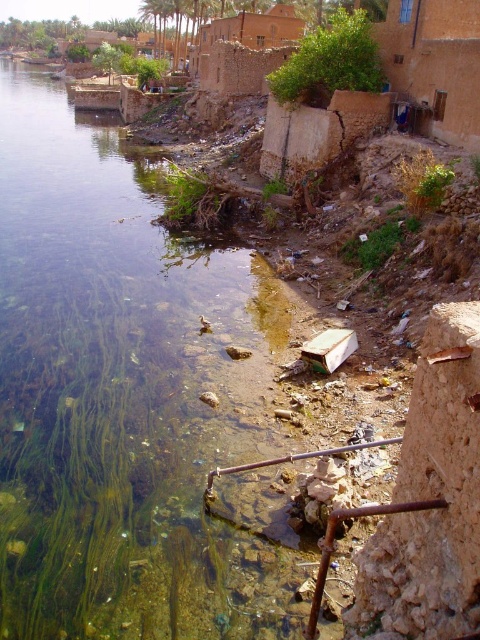
Question: In this image, where is clear water at river left located relative to green leafy bush at upper center?

Choices:
 (A) below
 (B) above

Answer: (A)

Question: Which of the following is the farthest from the observer?

Choices:
 (A) (57, 193)
 (B) (307, 52)

Answer: (A)

Question: Which of the following is the closest to the observer?

Choices:
 (A) (187, 308)
 (B) (292, 58)

Answer: (A)

Question: Does clear water at river left come in front of green leafy bush at upper center?

Choices:
 (A) no
 (B) yes

Answer: (B)

Question: Considering the relative positions of clear water at river left and green leafy bush at upper center in the image provided, where is clear water at river left located with respect to green leafy bush at upper center?

Choices:
 (A) above
 (B) below

Answer: (B)